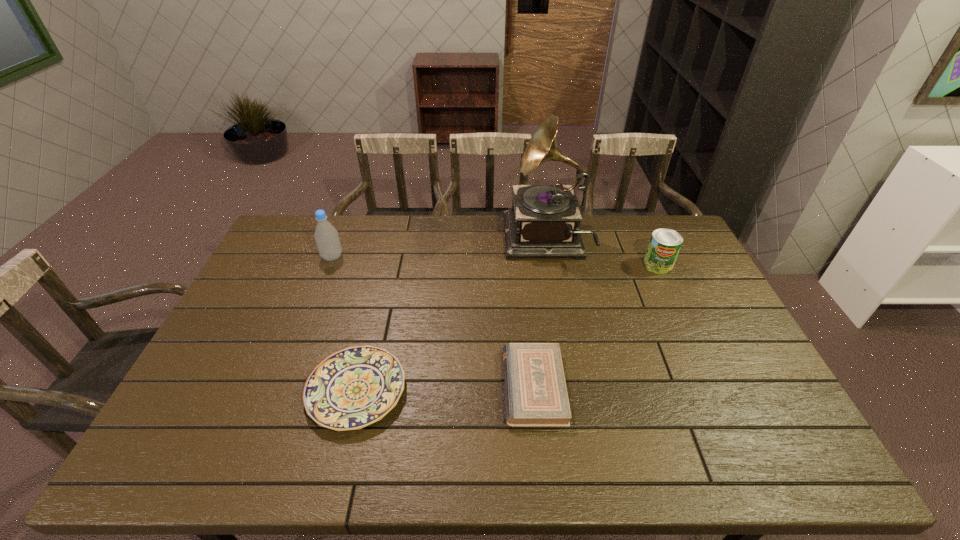
The image size is (960, 540). I want to click on unoccupied position between the leftmost object and the record player, so click(439, 249).

You are a GUI agent. You are given a task and a screenshot of the screen. Output one action in this format:
    pyautogui.click(x=<x>, y=<y>)
    Task: Click on the vacant area that lies between the second object from left to right and the Bible
    The width and height of the screenshot is (960, 540).
    Given the screenshot: What is the action you would take?
    pyautogui.click(x=445, y=388)

In order to click on free space that is in between the Bible and the second object from left to right in this screenshot , I will do `click(445, 388)`.

The height and width of the screenshot is (540, 960). In order to click on free area in between the fourth shortest object and the third shortest object in this screenshot , I will do `click(495, 261)`.

I want to click on free space between the leftmost object and the plate, so click(345, 324).

In order to click on free space between the third tallest object and the Bible in this screenshot , I will do `click(596, 326)`.

Find the location of a particular element. vacant space that's between the second shortest object and the third shortest object is located at coordinates (596, 326).

Identify which object is the second nearest to the leftmost object. Please provide its 2D coordinates. Your answer should be formatted as a tuple, i.e. [(x, y)], where the tuple contains the x and y coordinates of a point satisfying the conditions above.

[(544, 220)]

Locate an element on the screen. This screenshot has width=960, height=540. object that is the closest to the Bible is located at coordinates (355, 387).

Where is `vacant space that satisfies the following two spatial constraints: 1. on the horn of the record player; 2. on the front side of the shortest object`? The width and height of the screenshot is (960, 540). vacant space that satisfies the following two spatial constraints: 1. on the horn of the record player; 2. on the front side of the shortest object is located at coordinates (572, 390).